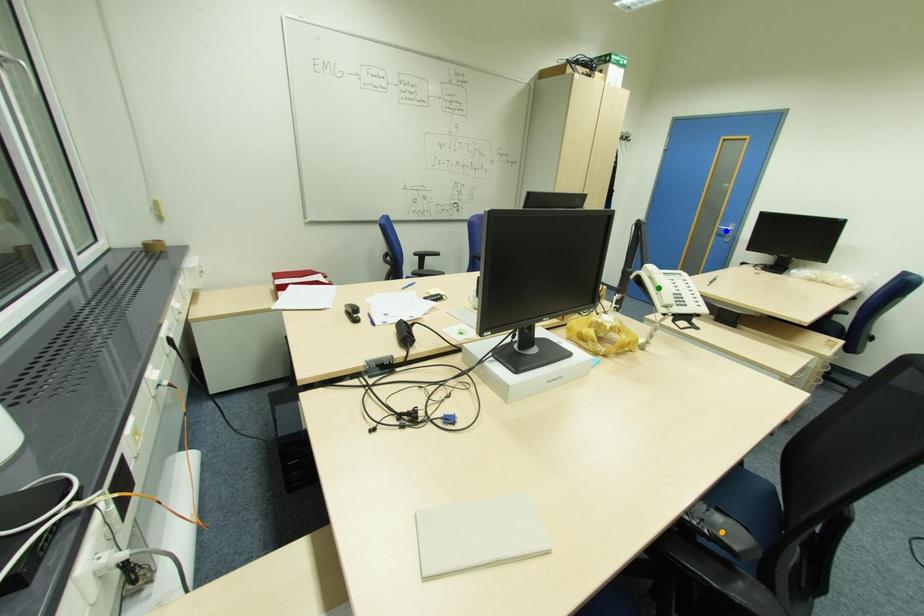
Order these from nearest to farthest:
A) green point
B) blue point
C) orange point

orange point
green point
blue point